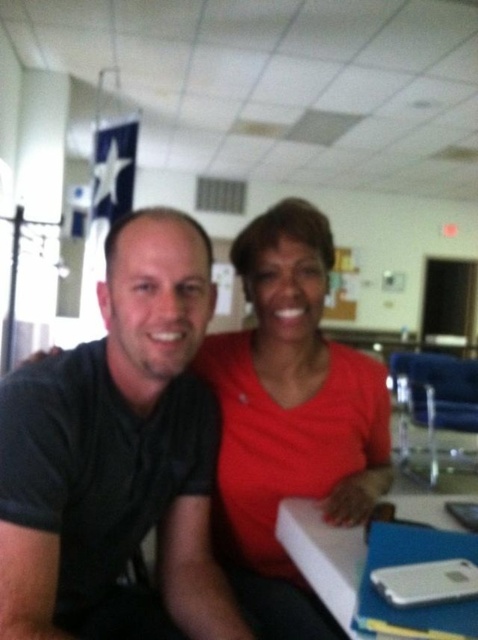
Based on the photo, between black matte shirt at center and matte red shirt at center, which one has less height?

black matte shirt at center is shorter.

Does black matte shirt at center have a greater width compared to matte red shirt at center?

Incorrect, black matte shirt at center's width does not surpass matte red shirt at center's.

What do you see at coordinates (118, 458) in the screenshot?
I see `black matte shirt at center` at bounding box center [118, 458].

The height and width of the screenshot is (640, 478). What are the coordinates of `black matte shirt at center` in the screenshot? It's located at (118, 458).

Does black matte shirt at center have a lesser width compared to white plastic table at lower center?

Indeed, black matte shirt at center has a lesser width compared to white plastic table at lower center.

Between black matte shirt at center and white plastic table at lower center, which one has more height?

With more height is black matte shirt at center.

This screenshot has height=640, width=478. Identify the location of black matte shirt at center. (118, 458).

The image size is (478, 640). I want to click on black matte shirt at center, so click(x=118, y=458).

Does point (221, 428) lie behind point (291, 504)?

Yes.

From the picture: Who is higher up, matte red shirt at center or white plastic table at lower center?

matte red shirt at center

Which is behind, point (371, 385) or point (315, 580)?

The point (371, 385) is behind.

Find the location of a particular element. This screenshot has width=478, height=640. matte red shirt at center is located at coordinates (291, 416).